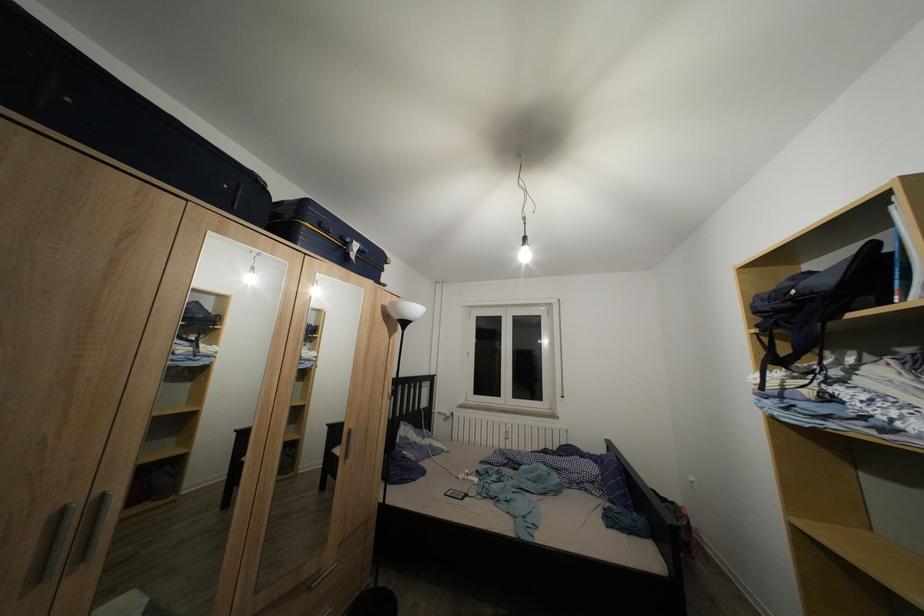
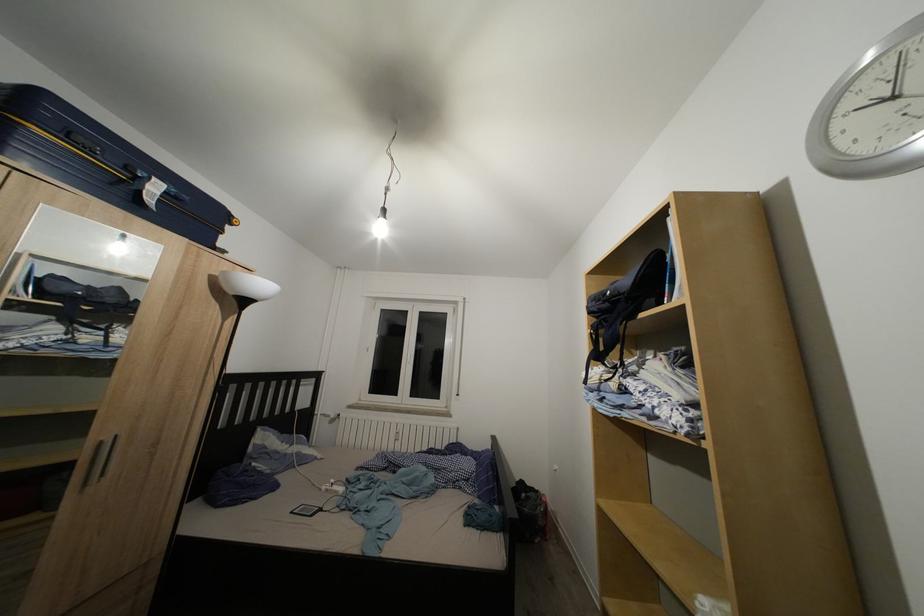
Question: The images are taken continuously from a first-person perspective. In which direction are you moving?

Choices:
 (A) Left
 (B) Right
 (C) Forward
 (D) Backward

Answer: (B)